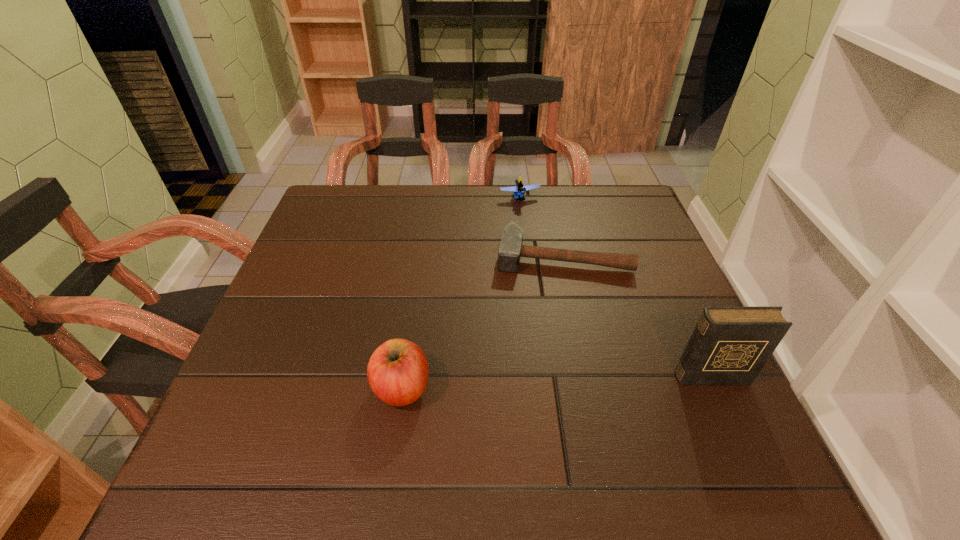
Locate an element on the screen. This screenshot has width=960, height=540. empty location between the rightmost object and the farthest object is located at coordinates (615, 287).

This screenshot has height=540, width=960. I want to click on empty space between the third shortest object and the third tallest object, so click(461, 293).

This screenshot has width=960, height=540. In order to click on vacant space in between the apple and the farthest object in this screenshot , I will do `click(461, 293)`.

Locate an element on the screen. vacant area between the Lego and the diary is located at coordinates (615, 287).

Locate an element on the screen. The height and width of the screenshot is (540, 960). free space between the tallest object and the shortest object is located at coordinates [636, 317].

In order to click on free space between the leftmost object and the second farthest object in this screenshot , I will do `click(483, 322)`.

Locate an element on the screen. Image resolution: width=960 pixels, height=540 pixels. object that can be found as the closest to the third shortest object is located at coordinates (510, 250).

Point out which object is positioned as the nearest to the apple. Please provide its 2D coordinates. Your answer should be formatted as a tuple, i.e. [(x, y)], where the tuple contains the x and y coordinates of a point satisfying the conditions above.

[(510, 250)]

At what (x,y) coordinates should I click in order to perform the action: click on vacant space that satisfies the following two spatial constraints: 1. on the front side of the second shortest object; 2. on the right side of the hammer. Please return your answer as a coordinate pair (x, y). The image size is (960, 540). Looking at the image, I should click on (527, 257).